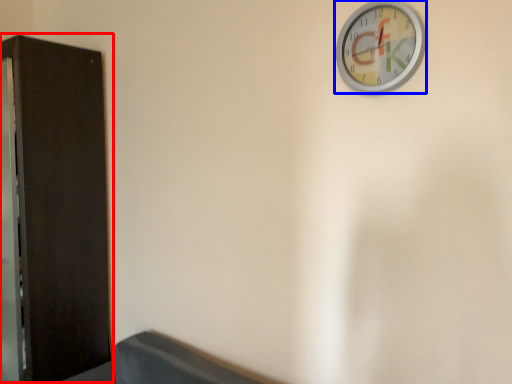
Question: Which point is further to the camera, dresser (highlighted by a red box) or wall clock (highlighted by a blue box)?

Choices:
 (A) dresser
 (B) wall clock

Answer: (A)